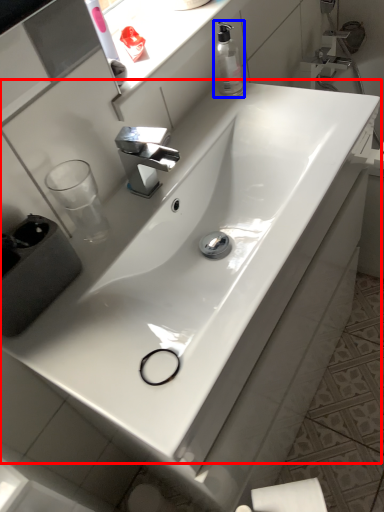
Question: Which of the following is the farthest to the observer, sink (highlighted by a red box) or soap dispenser (highlighted by a blue box)?

Choices:
 (A) sink
 (B) soap dispenser

Answer: (B)